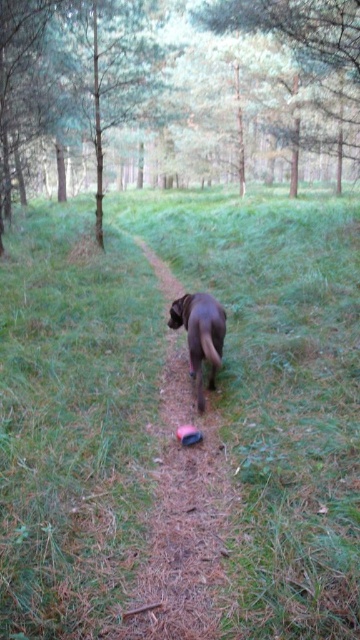
Question: Is brown fur dog at center below brown matte dog at center?

Choices:
 (A) no
 (B) yes

Answer: (B)

Question: Which point is closer to the camera taking this photo?

Choices:
 (A) (358, 388)
 (B) (200, 397)

Answer: (A)

Question: Which of the following is the farthest from the observer?

Choices:
 (A) green grassy at center
 (B) brown matte dog at center

Answer: (B)

Question: Is brown fur dog at center further to camera compared to brown matte dog at center?

Choices:
 (A) yes
 (B) no

Answer: (B)

Question: Which is farther from the brown matte dog at center?

Choices:
 (A) green grassy at center
 (B) brown fur dog at center

Answer: (A)

Question: Does green grassy at center come behind brown matte dog at center?

Choices:
 (A) no
 (B) yes

Answer: (A)